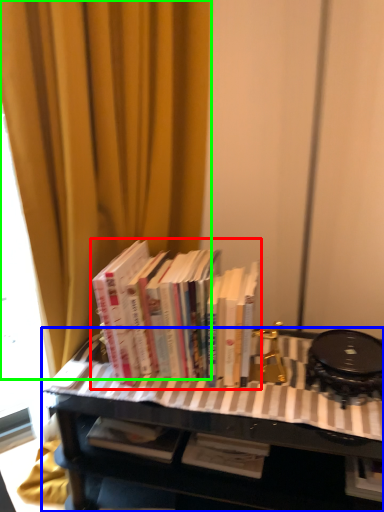
Question: Considering the real-world distances, which object is closest to book (highlighted by a red box)? table (highlighted by a blue box) or curtain (highlighted by a green box).

Choices:
 (A) table
 (B) curtain

Answer: (A)